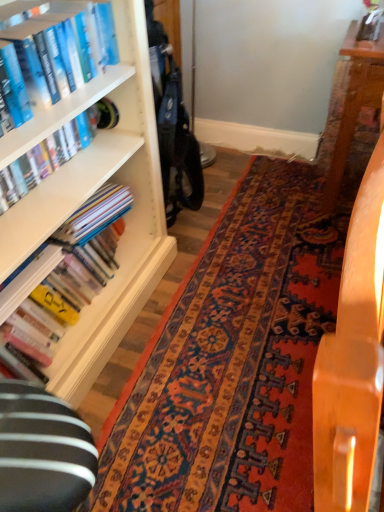
Question: From a real-world perspective, relative to blue hardcover book at upper left, which is the third book from bottom to top, is wooden table at center vertically above or below?

Choices:
 (A) below
 (B) above

Answer: (A)

Question: Is wooden table at center bigger or smaller than blue hardcover book at upper left, which is the third book from bottom to top?

Choices:
 (A) small
 (B) big

Answer: (B)

Question: Estimate the real-world distances between objects in this image. Which object is farther from the hardcover book at left, the 2th book when ordered from top to bottom?

Choices:
 (A) blue hardcover book at upper left, which is the third book from bottom to top
 (B) hardcover books at left, the first book in the bottom-to-top sequence
 (C) carpet with intricate patterns at center
 (D) wooden table at center

Answer: (D)

Question: Based on their relative distances, which object is nearer to the wooden table at center?

Choices:
 (A) carpet with intricate patterns at center
 (B) hardcover book at left, which is counted as the 2th book, starting from the bottom
 (C) hardcover books at left, which ranks as the 3th book in top-to-bottom order
 (D) blue hardcover book at upper left, acting as the first book starting from the top

Answer: (A)